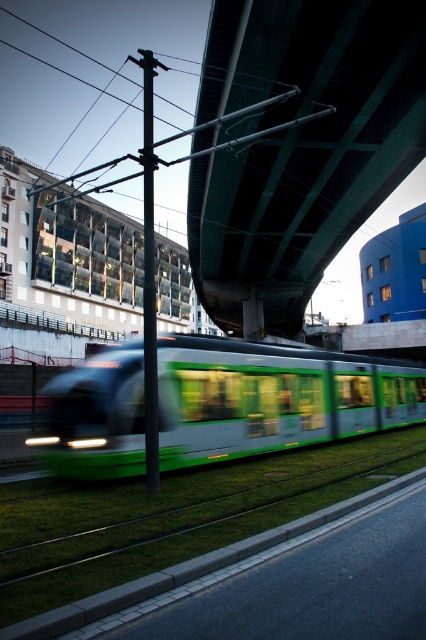
Is green concrete bridge at upper center behind green metallic train at center?

That is True.

Which is below, green concrete bridge at upper center or green metallic train at center?

green metallic train at center is below.

This screenshot has width=426, height=640. I want to click on green concrete bridge at upper center, so click(299, 145).